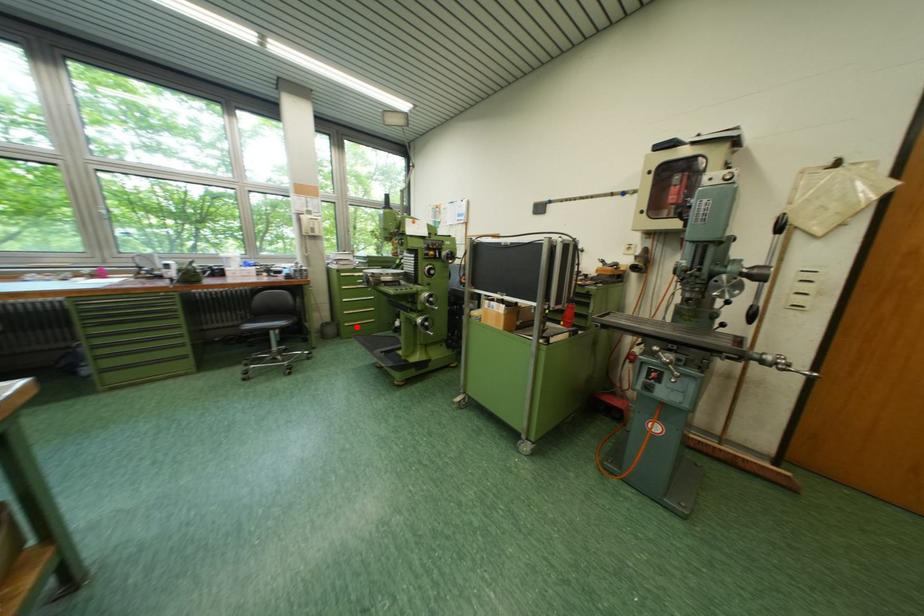
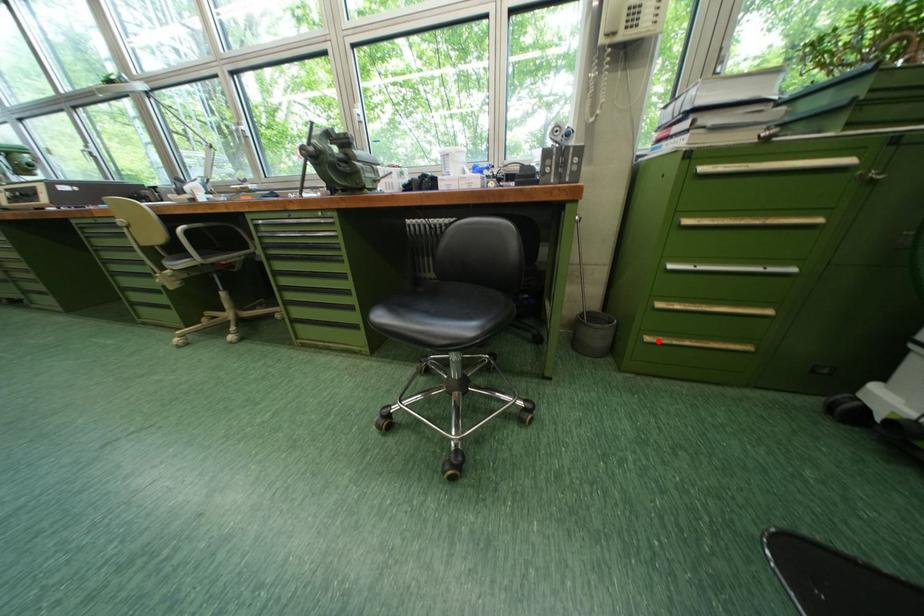
I am providing you with two images of the same scene from different viewpoints. A red point is marked on the first image and another point is marked on the second image. Does the point marked in image1 correspond to the same location as the one in image2?

Yes